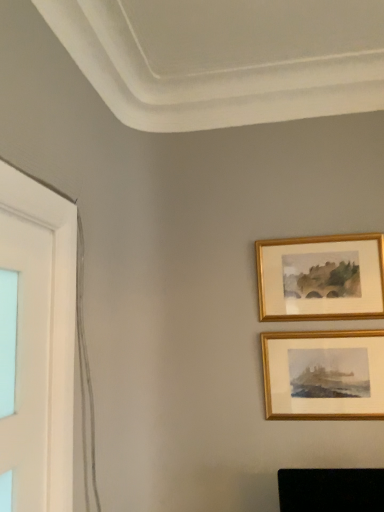
Describe the element at coordinates (324, 375) in the screenshot. I see `gold/golden frame at upper right, the second picture frame from the top` at that location.

You are a GUI agent. You are given a task and a screenshot of the screen. Output one action in this format:
    pyautogui.click(x=<x>, y=<y>)
    Task: Click on the gold/golden frame at upper right, the second picture frame from the top
    This screenshot has height=512, width=384.
    Given the screenshot: What is the action you would take?
    [x=324, y=375]

In the scene shown: How much space does gold/golden frame at upper right, which ranks as the first picture frame in bottom-to-top order, occupy vertically?

gold/golden frame at upper right, which ranks as the first picture frame in bottom-to-top order, is 14.66 inches in height.

What is the approximate width of gold/golden frame at upper right, the 1th picture frame viewed from the top?

gold/golden frame at upper right, the 1th picture frame viewed from the top, is 2.50 inches in width.

Describe the element at coordinates (330, 271) in the screenshot. I see `gold/golden frame at upper right, the 2th picture frame when ordered from bottom to top` at that location.

Based on the photo, measure the distance between gold/golden frame at upper right, the 1th picture frame viewed from the top, and camera.

gold/golden frame at upper right, the 1th picture frame viewed from the top, and camera are 1.63 meters apart from each other.

The image size is (384, 512). I want to click on gold/golden frame at upper right, the 1th picture frame viewed from the top, so click(330, 271).

What are the coordinates of `gold/golden frame at upper right, the second picture frame from the top` in the screenshot? It's located at pyautogui.click(x=324, y=375).

Can you confirm if gold/golden frame at upper right, the 2th picture frame when ordered from bottom to top, is positioned to the right of gold/golden frame at upper right, which ranks as the first picture frame in bottom-to-top order?

Correct, you'll find gold/golden frame at upper right, the 2th picture frame when ordered from bottom to top, to the right of gold/golden frame at upper right, which ranks as the first picture frame in bottom-to-top order.

Is gold/golden frame at upper right, the 2th picture frame when ordered from bottom to top, further to the viewer compared to gold/golden frame at upper right, the second picture frame from the top?

That is True.

Considering the points (283, 245) and (315, 408), which point is behind, point (283, 245) or point (315, 408)?

The point (283, 245) is behind.

Looking at this image, from the image's perspective, is gold/golden frame at upper right, the 1th picture frame viewed from the top, located above or below gold/golden frame at upper right, which ranks as the first picture frame in bottom-to-top order?

gold/golden frame at upper right, the 1th picture frame viewed from the top, is situated higher than gold/golden frame at upper right, which ranks as the first picture frame in bottom-to-top order, in the image.

From a real-world perspective, is gold/golden frame at upper right, the 2th picture frame when ordered from bottom to top, on top of gold/golden frame at upper right, the second picture frame from the top?

Yes, from a real-world perspective, gold/golden frame at upper right, the 2th picture frame when ordered from bottom to top, is on top of gold/golden frame at upper right, the second picture frame from the top.

Which object is wider, gold/golden frame at upper right, the 1th picture frame viewed from the top, or gold/golden frame at upper right, which ranks as the first picture frame in bottom-to-top order?

With larger width is gold/golden frame at upper right, the 1th picture frame viewed from the top.

Between gold/golden frame at upper right, the 2th picture frame when ordered from bottom to top, and gold/golden frame at upper right, which ranks as the first picture frame in bottom-to-top order, which one has more height?

With more height is gold/golden frame at upper right, which ranks as the first picture frame in bottom-to-top order.

Between gold/golden frame at upper right, the 2th picture frame when ordered from bottom to top, and gold/golden frame at upper right, which ranks as the first picture frame in bottom-to-top order, which one has smaller size?

With smaller size is gold/golden frame at upper right, which ranks as the first picture frame in bottom-to-top order.

Could gold/golden frame at upper right, the second picture frame from the top, be considered to be inside gold/golden frame at upper right, the 1th picture frame viewed from the top?

No, gold/golden frame at upper right, the 1th picture frame viewed from the top, does not contain gold/golden frame at upper right, the second picture frame from the top.

Is gold/golden frame at upper right, the 1th picture frame viewed from the top, not near gold/golden frame at upper right, which ranks as the first picture frame in bottom-to-top order?

That's not correct — gold/golden frame at upper right, the 1th picture frame viewed from the top, is a little close to gold/golden frame at upper right, which ranks as the first picture frame in bottom-to-top order.

Is gold/golden frame at upper right, the 1th picture frame viewed from the top, positioned with its back to gold/golden frame at upper right, which ranks as the first picture frame in bottom-to-top order?

gold/golden frame at upper right, the 1th picture frame viewed from the top, does not have its back to gold/golden frame at upper right, which ranks as the first picture frame in bottom-to-top order.

Where is `picture frame below the gold/golden frame at upper right, the 1th picture frame viewed from the top (from a real-world perspective)`? The image size is (384, 512). picture frame below the gold/golden frame at upper right, the 1th picture frame viewed from the top (from a real-world perspective) is located at coordinates (324, 375).

Which is more to the right, gold/golden frame at upper right, which ranks as the first picture frame in bottom-to-top order, or gold/golden frame at upper right, the 2th picture frame when ordered from bottom to top?

From the viewer's perspective, gold/golden frame at upper right, the 2th picture frame when ordered from bottom to top, appears more on the right side.

Which object is further away from the camera, gold/golden frame at upper right, the second picture frame from the top, or gold/golden frame at upper right, the 2th picture frame when ordered from bottom to top?

Positioned behind is gold/golden frame at upper right, the 2th picture frame when ordered from bottom to top.

Is point (270, 388) positioned before point (379, 306)?

No, (270, 388) is further to viewer.

From the image's perspective, is gold/golden frame at upper right, the second picture frame from the top, below gold/golden frame at upper right, the 2th picture frame when ordered from bottom to top?

Indeed, from the image's perspective, gold/golden frame at upper right, the second picture frame from the top, is shown beneath gold/golden frame at upper right, the 2th picture frame when ordered from bottom to top.

From a real-world perspective, is gold/golden frame at upper right, which ranks as the first picture frame in bottom-to-top order, physically located above or below gold/golden frame at upper right, the 1th picture frame viewed from the top?

gold/golden frame at upper right, which ranks as the first picture frame in bottom-to-top order, is below gold/golden frame at upper right, the 1th picture frame viewed from the top.

Which object is wider, gold/golden frame at upper right, the second picture frame from the top, or gold/golden frame at upper right, the 2th picture frame when ordered from bottom to top?

With larger width is gold/golden frame at upper right, the 2th picture frame when ordered from bottom to top.

Is gold/golden frame at upper right, which ranks as the first picture frame in bottom-to-top order, taller or shorter than gold/golden frame at upper right, the 1th picture frame viewed from the top?

Considering their sizes, gold/golden frame at upper right, which ranks as the first picture frame in bottom-to-top order, has more height than gold/golden frame at upper right, the 1th picture frame viewed from the top.

Who is bigger, gold/golden frame at upper right, the second picture frame from the top, or gold/golden frame at upper right, the 2th picture frame when ordered from bottom to top?

gold/golden frame at upper right, the 2th picture frame when ordered from bottom to top, is bigger.

Is gold/golden frame at upper right, the second picture frame from the top, positioned beyond the bounds of gold/golden frame at upper right, the 2th picture frame when ordered from bottom to top?

Yes.

Is gold/golden frame at upper right, which ranks as the first picture frame in bottom-to-top order, in contact with gold/golden frame at upper right, the 2th picture frame when ordered from bottom to top?

No, gold/golden frame at upper right, which ranks as the first picture frame in bottom-to-top order, is not in contact with gold/golden frame at upper right, the 2th picture frame when ordered from bottom to top.

Is gold/golden frame at upper right, the second picture frame from the top, looking in the opposite direction of gold/golden frame at upper right, the 1th picture frame viewed from the top?

No.

Looking at this image, can you tell me how much gold/golden frame at upper right, which ranks as the first picture frame in bottom-to-top order, and gold/golden frame at upper right, the 1th picture frame viewed from the top, differ in facing direction?

There is a 0.396-degree angle between the facing directions of gold/golden frame at upper right, which ranks as the first picture frame in bottom-to-top order, and gold/golden frame at upper right, the 1th picture frame viewed from the top.

Image resolution: width=384 pixels, height=512 pixels. I want to click on picture frame that is on the right side of gold/golden frame at upper right, the second picture frame from the top, so click(x=330, y=271).

In order to click on picture frame on the right of the gold/golden frame at upper right, which ranks as the first picture frame in bottom-to-top order in this screenshot , I will do `click(330, 271)`.

What are the coordinates of `picture frame above the gold/golden frame at upper right, which ranks as the first picture frame in bottom-to-top order (from the image's perspective)` in the screenshot? It's located at (330, 271).